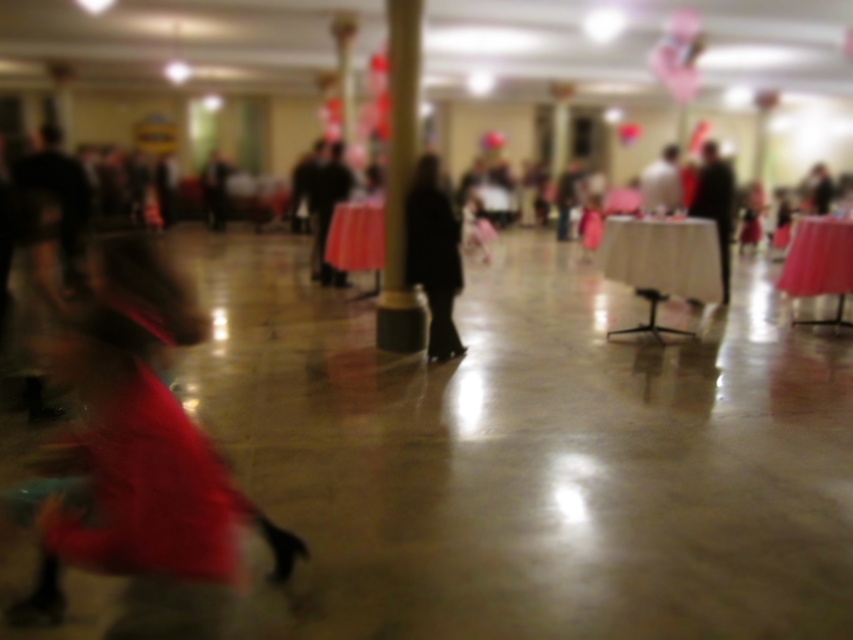
You are standing in the middle of the room and see the smooth pink table at right and the black fabric coat at right. Which object is closer to you?

The smooth pink table at right is closer to you because it is further to the viewer than the black fabric coat at right.